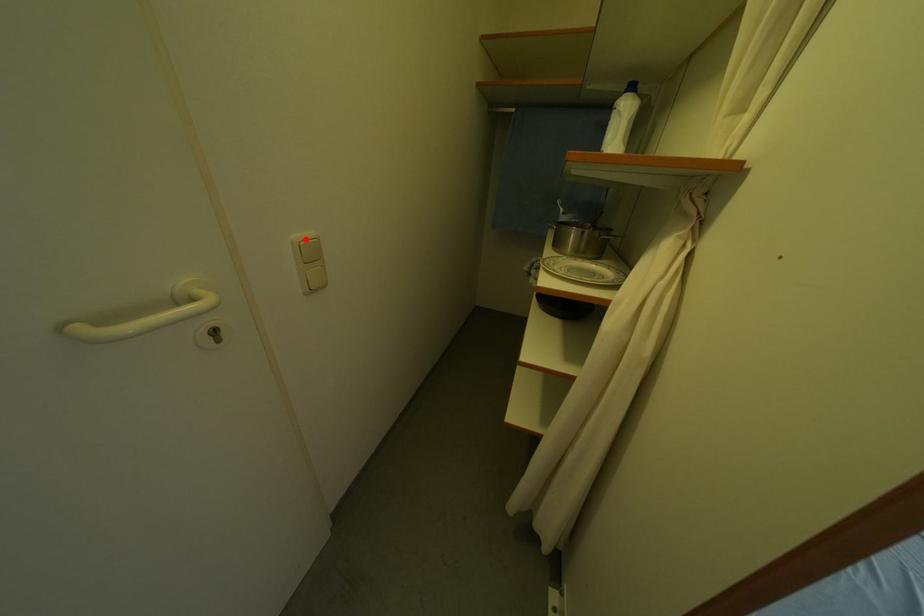
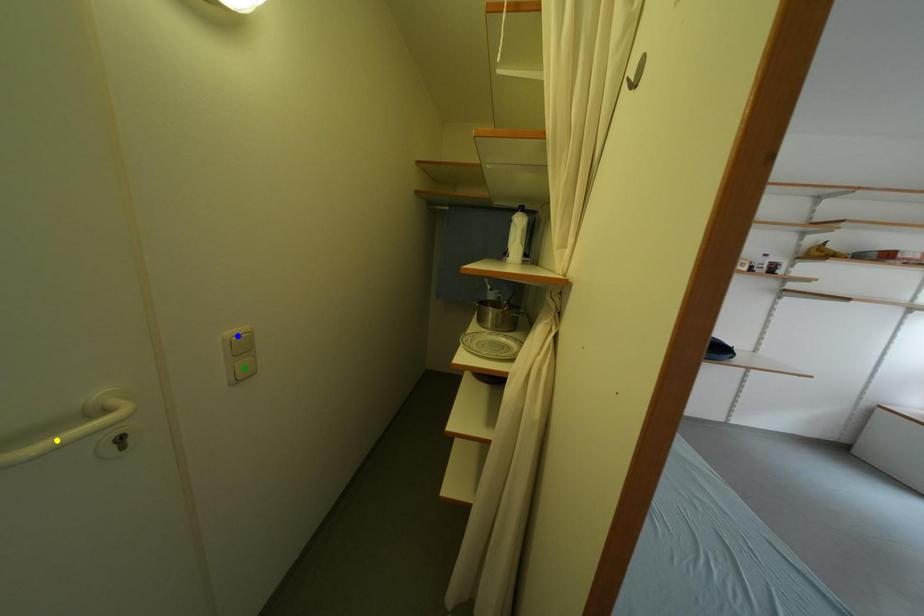
Question: I am providing you with two images of the same scene from different viewpoints. A red point is marked on the first image. You are given multiple points on the second image. Can you choose the point in image 2 that corresponds to the point in image 1?

Choices:
 (A) green point
 (B) blue point
 (C) yellow point

Answer: (B)